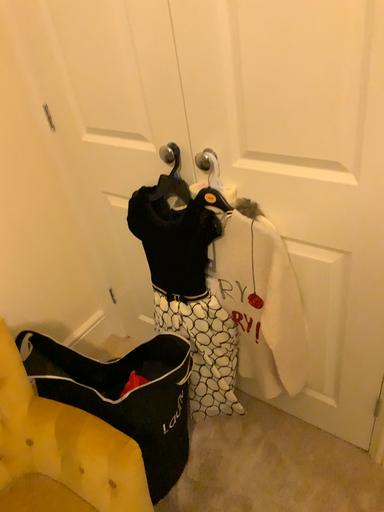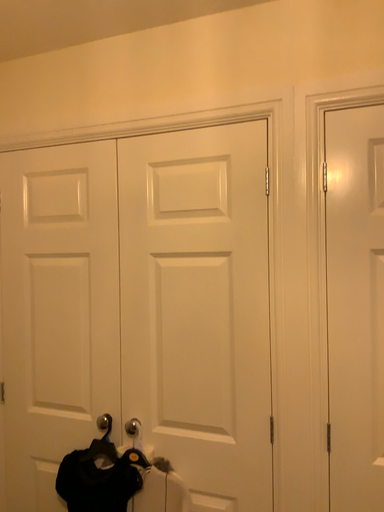
Question: Which way did the camera rotate in the video?

Choices:
 (A) rotated left
 (B) rotated right

Answer: (B)